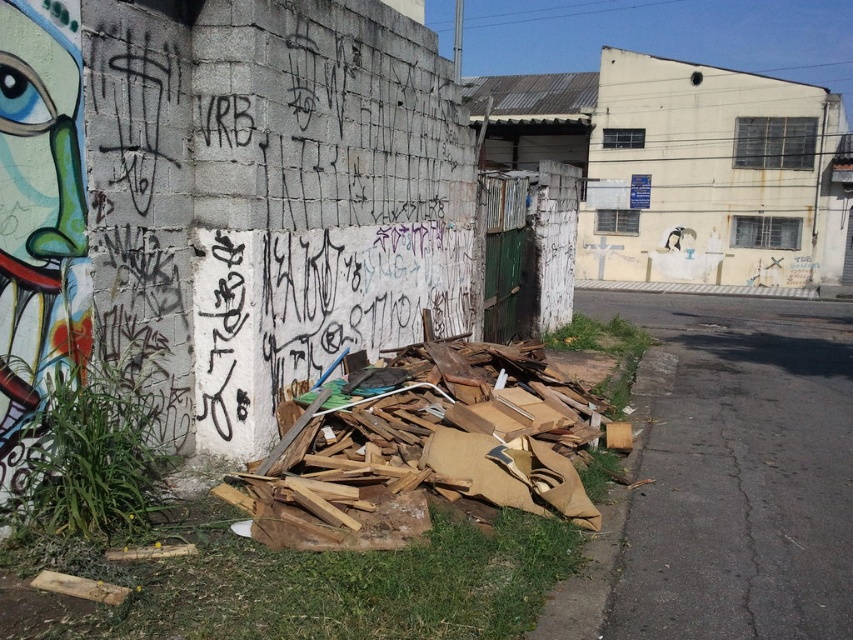
You are a delivery person who needs to place a new package on the ground near the wall. You see the brown cardboard debris at lower right and the brown cardboard at lower left. Which location would allow you to place the package higher up?

The brown cardboard debris at lower right is located above the brown cardboard at lower left, so placing the package there would be higher up.

You are a city planner assessing the urban space shown. You see the brown cardboard debris at lower right and the brown cardboard at lower left. Which of these two items takes up more space in the scene?

The brown cardboard debris at lower right is bigger than the brown cardboard at lower left, so it takes up more space in the scene.